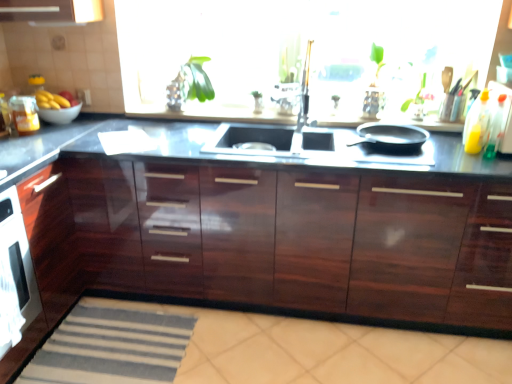
Identify the location of vacant space to the left of translucent plastic bottle at right, the second bottle viewed from the back. (463, 158).